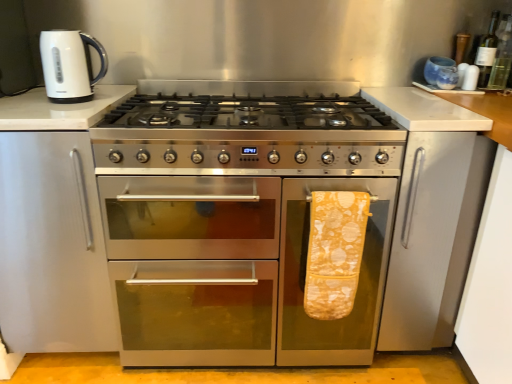
Question: From a real-world perspective, is green glass bottle at upper right, the 1th bottle when ordered from left to right, below yellow printed towel at right?

Choices:
 (A) no
 (B) yes

Answer: (A)

Question: Are green glass bottle at upper right, the 1th bottle when ordered from left to right, and yellow printed towel at right located far from each other?

Choices:
 (A) no
 (B) yes

Answer: (A)

Question: Is green glass bottle at upper right, the 1th bottle when ordered from left to right, outside yellow printed towel at right?

Choices:
 (A) yes
 (B) no

Answer: (A)

Question: From the image's perspective, does green glass bottle at upper right, the 1th bottle when ordered from left to right, appear higher than yellow printed towel at right?

Choices:
 (A) no
 (B) yes

Answer: (B)

Question: Considering the relative sizes of green glass bottle at upper right, which ranks as the 2th bottle in right-to-left order, and yellow printed towel at right in the image provided, is green glass bottle at upper right, which ranks as the 2th bottle in right-to-left order, wider than yellow printed towel at right?

Choices:
 (A) yes
 (B) no

Answer: (A)

Question: From a real-world perspective, is green glass bottle at upper right, which ranks as the 2th bottle in right-to-left order, physically above yellow printed towel at right?

Choices:
 (A) yes
 (B) no

Answer: (A)

Question: Can you confirm if white glossy electric kettle at upper left is wider than green glass bottle at upper right, placed as the 1th bottle when sorted from right to left?

Choices:
 (A) no
 (B) yes

Answer: (B)

Question: Does white glossy electric kettle at upper left have a lesser width compared to green glass bottle at upper right, placed as the 1th bottle when sorted from right to left?

Choices:
 (A) no
 (B) yes

Answer: (A)

Question: Does white glossy electric kettle at upper left appear on the right side of green glass bottle at upper right, placed as the 1th bottle when sorted from right to left?

Choices:
 (A) yes
 (B) no

Answer: (B)

Question: Is the position of white glossy electric kettle at upper left less distant than that of green glass bottle at upper right, placed as the 1th bottle when sorted from right to left?

Choices:
 (A) yes
 (B) no

Answer: (A)

Question: Is white glossy electric kettle at upper left outside of green glass bottle at upper right, placed as the 1th bottle when sorted from right to left?

Choices:
 (A) no
 (B) yes

Answer: (B)

Question: From a real-world perspective, is white glossy electric kettle at upper left located higher than green glass bottle at upper right, positioned as the second bottle in left-to-right order?

Choices:
 (A) yes
 (B) no

Answer: (B)

Question: Is green glass bottle at upper right, placed as the 1th bottle when sorted from right to left, oriented towards yellow printed towel at right?

Choices:
 (A) yes
 (B) no

Answer: (B)